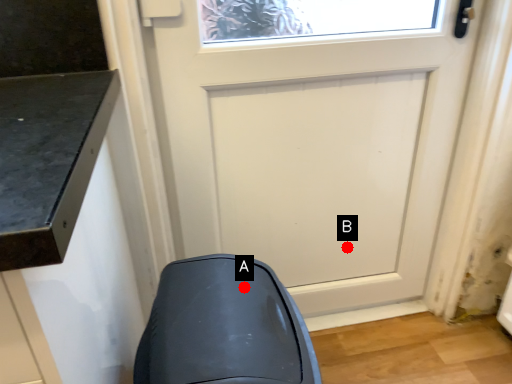
Question: Two points are circled on the image, labeled by A and B beside each circle. Among these points, which one is farthest from the camera?

Choices:
 (A) A is further
 (B) B is further

Answer: (B)